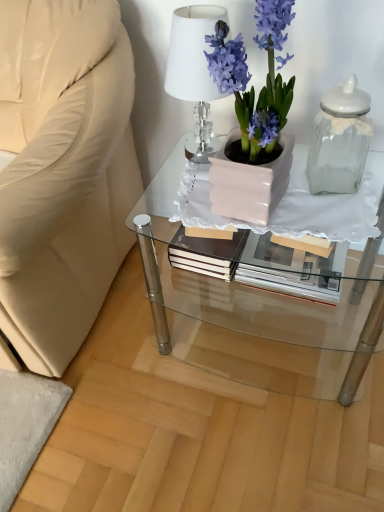
Where is `free space to the left of matte white glass table at center`? This screenshot has height=512, width=384. free space to the left of matte white glass table at center is located at coordinates (113, 376).